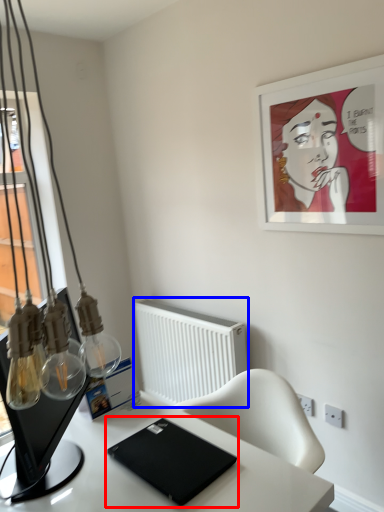
Question: Which point is further to the camera, laptop (highlighted by a red box) or radiator (highlighted by a blue box)?

Choices:
 (A) laptop
 (B) radiator

Answer: (B)